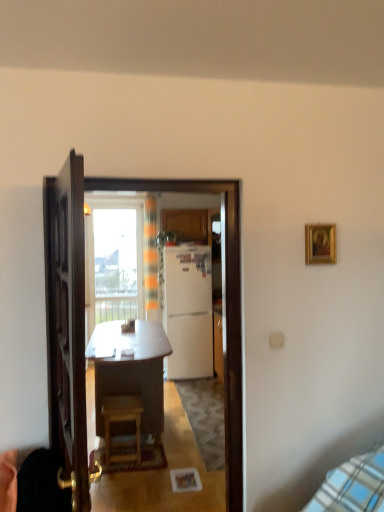
Question: Considering the relative sizes of wooden desk at center and wooden door at center in the image provided, is wooden desk at center bigger than wooden door at center?

Choices:
 (A) no
 (B) yes

Answer: (B)

Question: Considering the relative positions of wooden desk at center and wooden door at center in the image provided, is wooden desk at center in front of wooden door at center?

Choices:
 (A) no
 (B) yes

Answer: (A)

Question: From a real-world perspective, is wooden desk at center physically below wooden door at center?

Choices:
 (A) yes
 (B) no

Answer: (A)

Question: Does wooden desk at center have a lesser width compared to wooden door at center?

Choices:
 (A) no
 (B) yes

Answer: (A)

Question: Can you confirm if wooden desk at center is positioned to the left of wooden door at center?

Choices:
 (A) no
 (B) yes

Answer: (B)

Question: From the image's perspective, is wooden desk at center over wooden door at center?

Choices:
 (A) no
 (B) yes

Answer: (A)

Question: Is wooden door at center beside transparent glass window at upper center?

Choices:
 (A) no
 (B) yes

Answer: (A)

Question: Can you confirm if wooden door at center is wider than transparent glass window at upper center?

Choices:
 (A) yes
 (B) no

Answer: (A)

Question: From a real-world perspective, is wooden door at center under transparent glass window at upper center?

Choices:
 (A) no
 (B) yes

Answer: (B)

Question: From the image's perspective, is wooden door at center above transparent glass window at upper center?

Choices:
 (A) no
 (B) yes

Answer: (A)

Question: Is transparent glass window at upper center surrounded by wooden door at center?

Choices:
 (A) yes
 (B) no

Answer: (B)

Question: Does wooden door at center have a lesser width compared to transparent glass window at upper center?

Choices:
 (A) no
 (B) yes

Answer: (A)

Question: From a real-world perspective, is gold-framed picture at upper right physically below white glossy refrigerator at center?

Choices:
 (A) yes
 (B) no

Answer: (B)